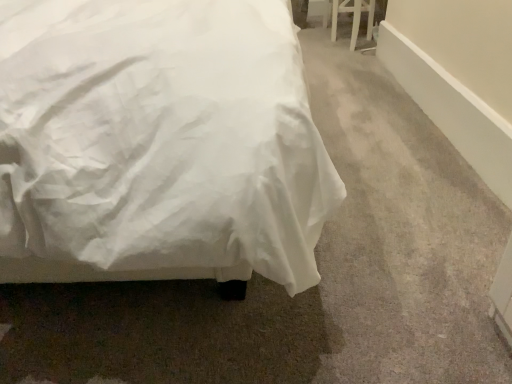
What do you see at coordinates (353, 17) in the screenshot?
I see `white plastic chair at upper right` at bounding box center [353, 17].

Locate an element on the screen. white plastic chair at upper right is located at coordinates (353, 17).

Where is `white plastic chair at upper right`? The image size is (512, 384). white plastic chair at upper right is located at coordinates (353, 17).